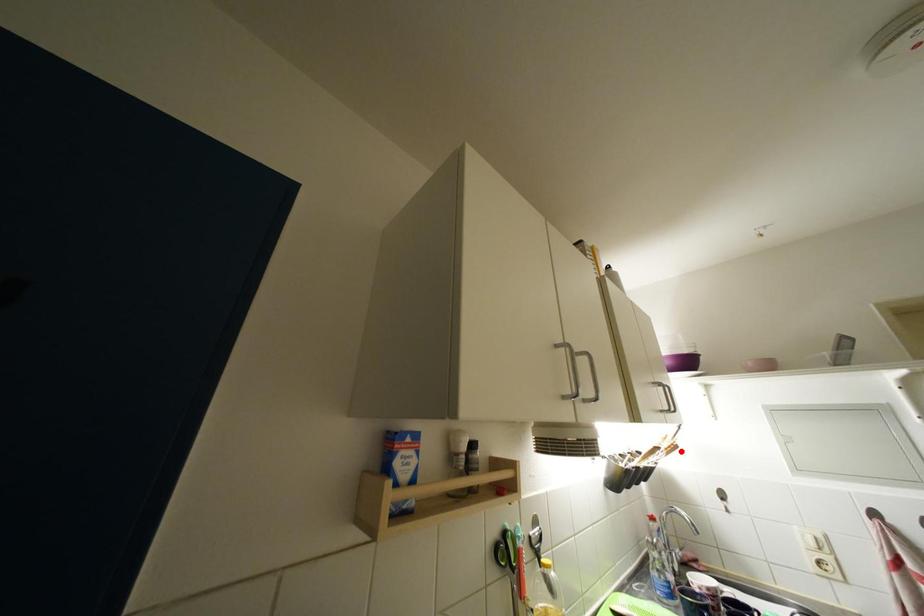
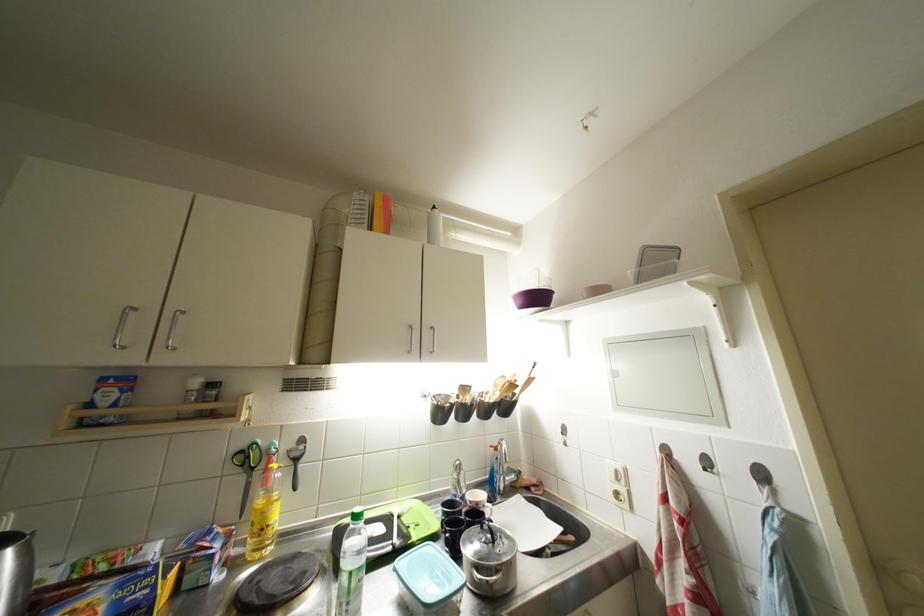
The point at the highlighted location is marked in the first image. Where is the corresponding point in the second image?

(519, 390)